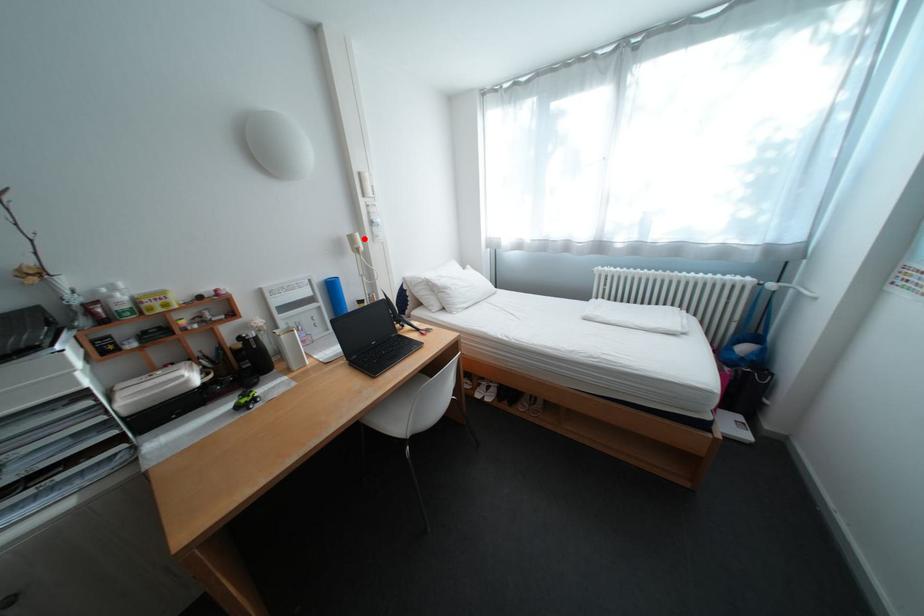
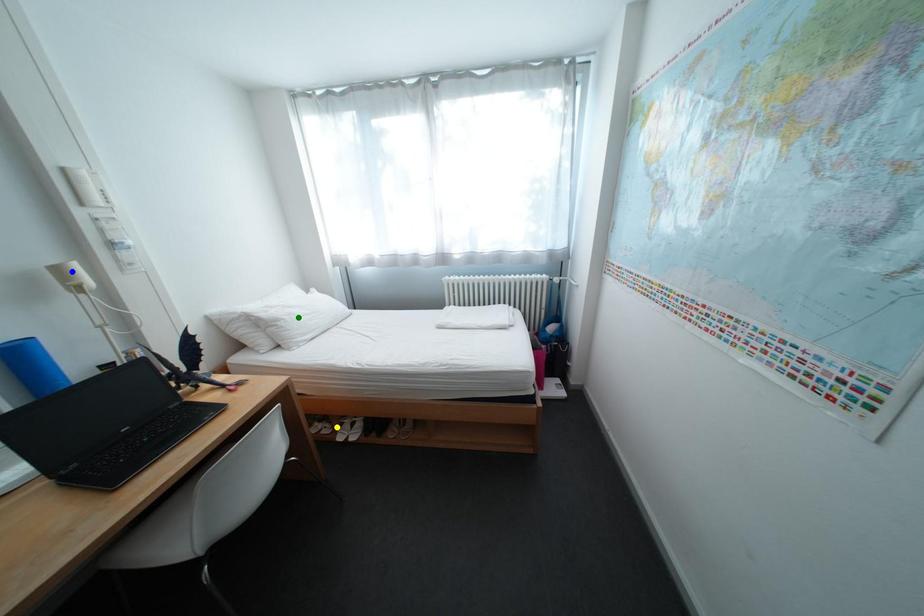
Question: I am providing you with two images of the same scene from different viewpoints. A red point is marked on the first image. You are given multiple points on the second image. Which mark in image 2 goes with the point in image 1?

Choices:
 (A) green point
 (B) yellow point
 (C) blue point

Answer: (C)